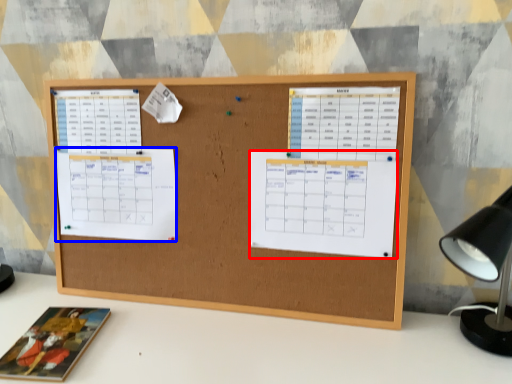
Question: Which of the following is the closest to the observer, list (highlighted by a red box) or list (highlighted by a blue box)?

Choices:
 (A) list
 (B) list

Answer: (A)